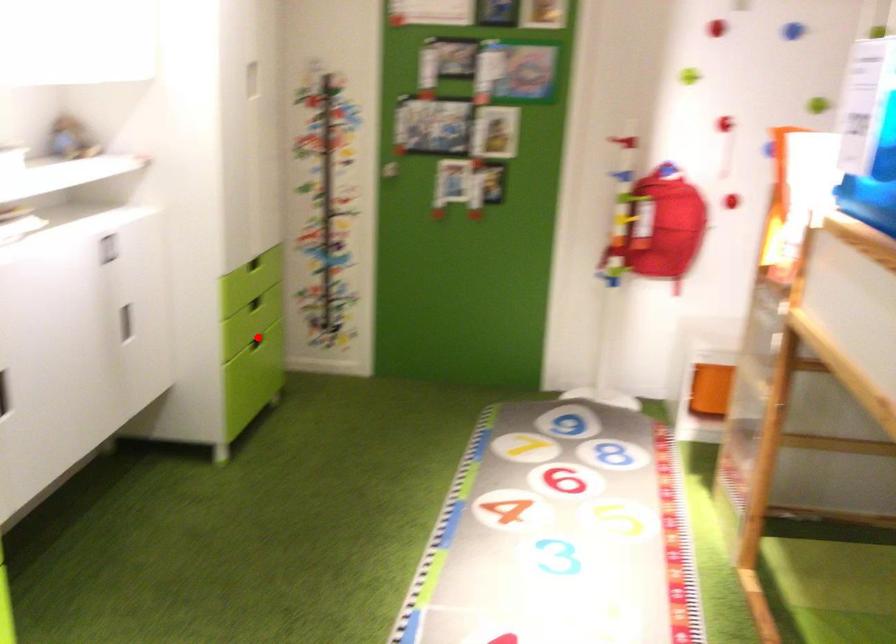
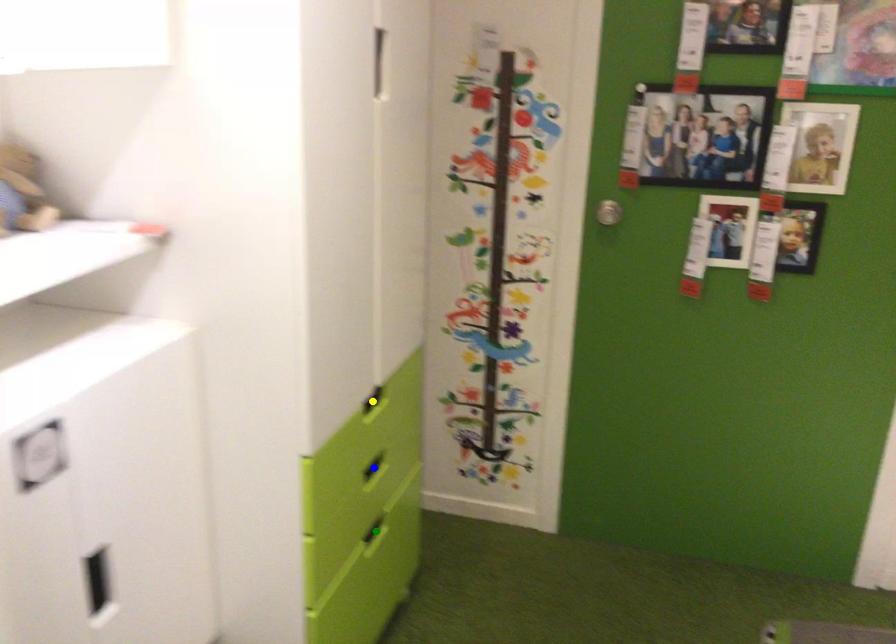
Question: I am providing you with two images of the same scene from different viewpoints. A red point is marked on the first image. You are given multiple points on the second image. Which point in image 2 is actually the same real-world point as the red point in image 1?

Choices:
 (A) green point
 (B) yellow point
 (C) blue point

Answer: (A)